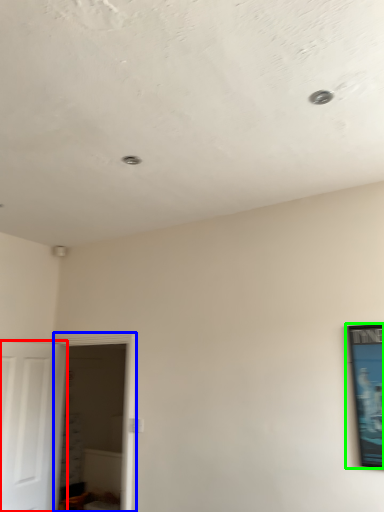
Question: Estimate the real-world distances between objects in this image. Which object is farther from door (highlighted by a red box), glass door (highlighted by a blue box) or picture frame (highlighted by a green box)?

Choices:
 (A) glass door
 (B) picture frame

Answer: (B)